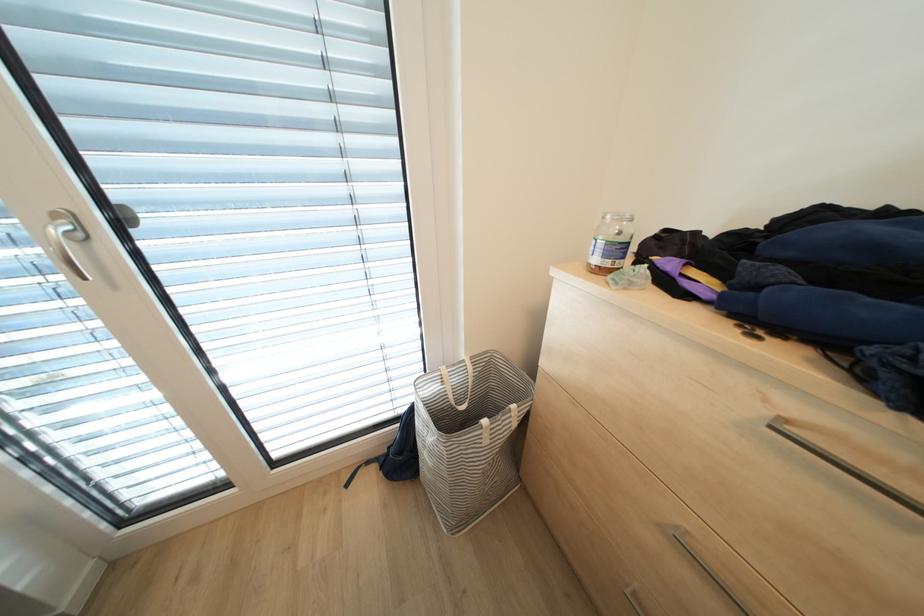
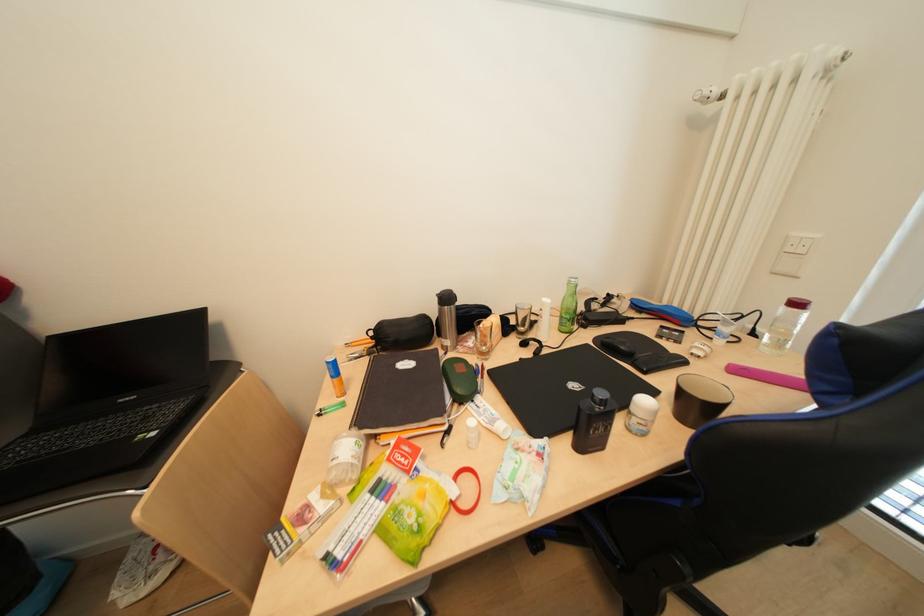
Based on the continuous images, in which direction is the camera rotating?

The camera rotated toward left-down.